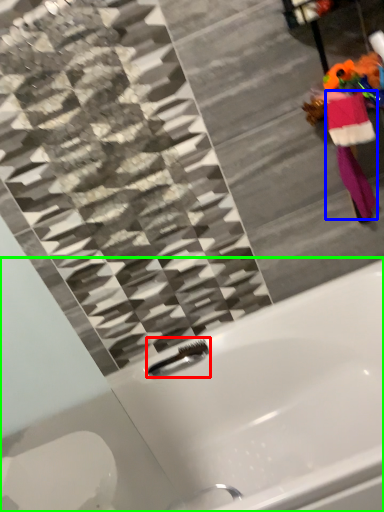
Question: Which object is positioned closest to faucet (highlighted by a red box)? Select from robe (highlighted by a blue box) and bathtub (highlighted by a green box).

Choices:
 (A) robe
 (B) bathtub

Answer: (B)